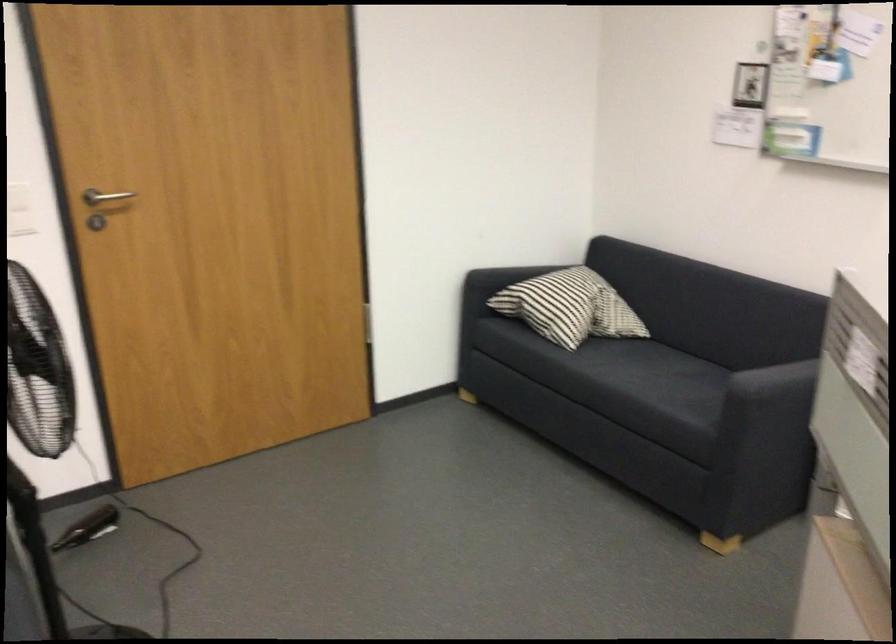
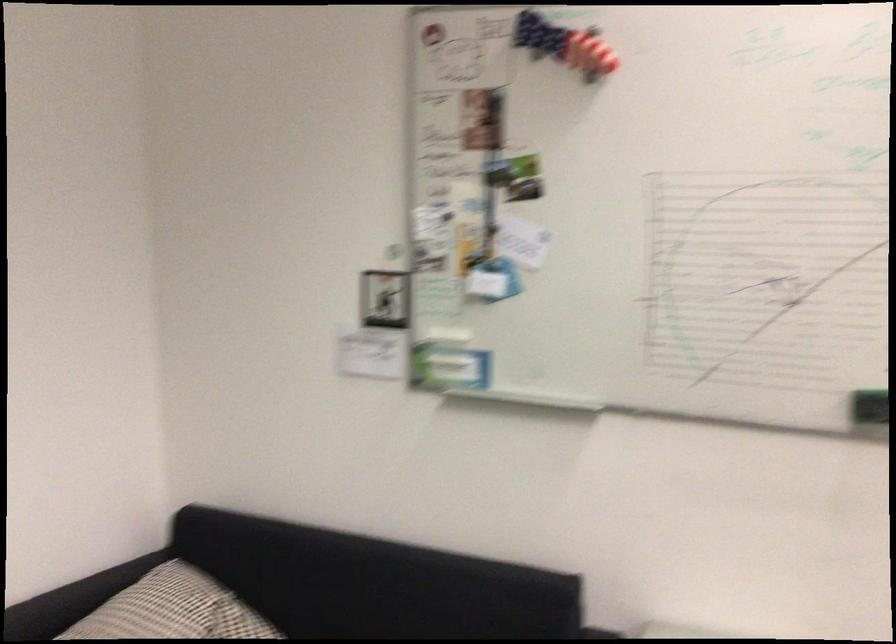
Question: I am providing you with two images of the same scene from different viewpoints. After the viewpoint changes to image2, which objects are now occluded?

Choices:
 (A) black sofa armrest
 (B) whiteboard eraser
 (C) sofa sitting surface
 (D) none of these

Answer: (D)